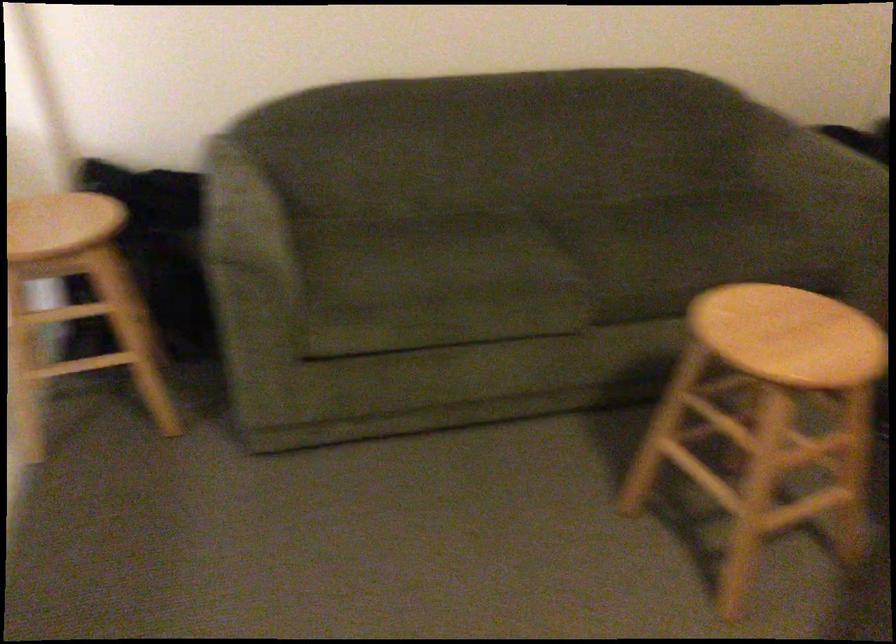
Where is `sofa sitting surface`? sofa sitting surface is located at coordinates (530, 261).